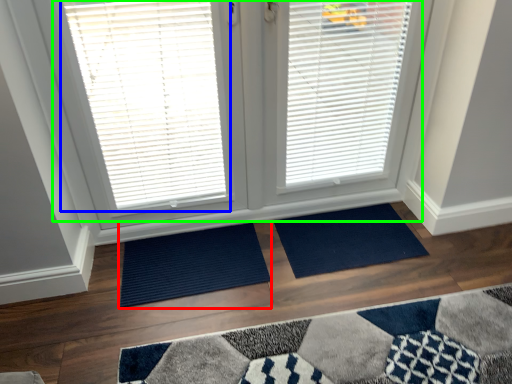
Question: Which object is the farthest from doormat (highlighted by a red box)? Choose among these: window blind (highlighted by a blue box) or bay window (highlighted by a green box).

Choices:
 (A) window blind
 (B) bay window

Answer: (A)